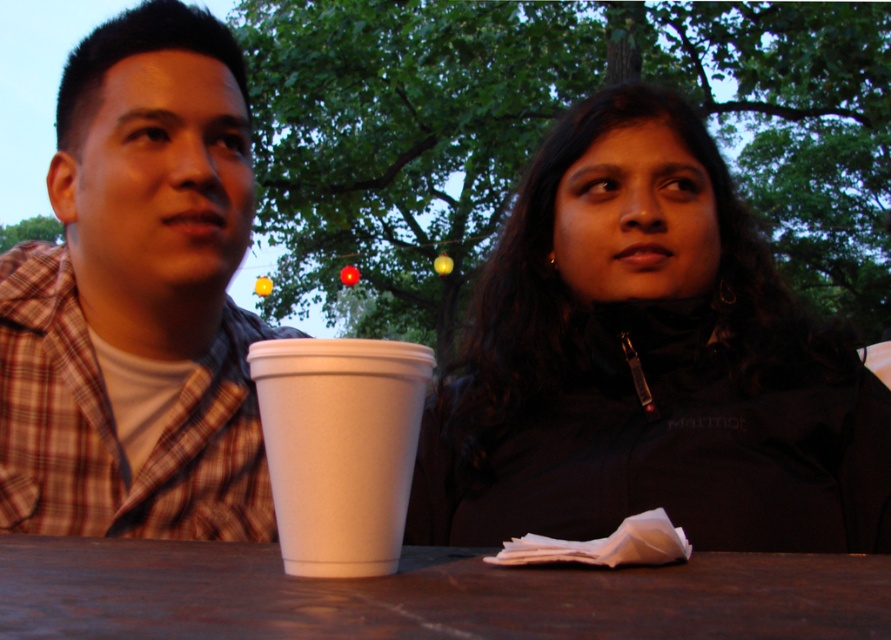
Question: Which point is closer to the camera?

Choices:
 (A) white styrofoam cup at center
 (B) brown wooden table at center
 (C) plaid shirt at left

Answer: (B)

Question: Can you confirm if brown wooden table at center is positioned to the left of white styrofoam cup at center?

Choices:
 (A) yes
 (B) no

Answer: (B)

Question: Which point is closer to the camera?

Choices:
 (A) white styrofoam cup at center
 (B) black matte jacket at center
 (C) brown wooden table at center
 (D) plaid shirt at left

Answer: (C)

Question: Is brown wooden table at center positioned behind white styrofoam cup at center?

Choices:
 (A) yes
 (B) no

Answer: (B)

Question: Does black matte jacket at center have a larger size compared to white styrofoam cup at center?

Choices:
 (A) no
 (B) yes

Answer: (B)

Question: Based on their relative distances, which object is nearer to the plaid shirt at left?

Choices:
 (A) brown wooden table at center
 (B) white styrofoam cup at center

Answer: (A)